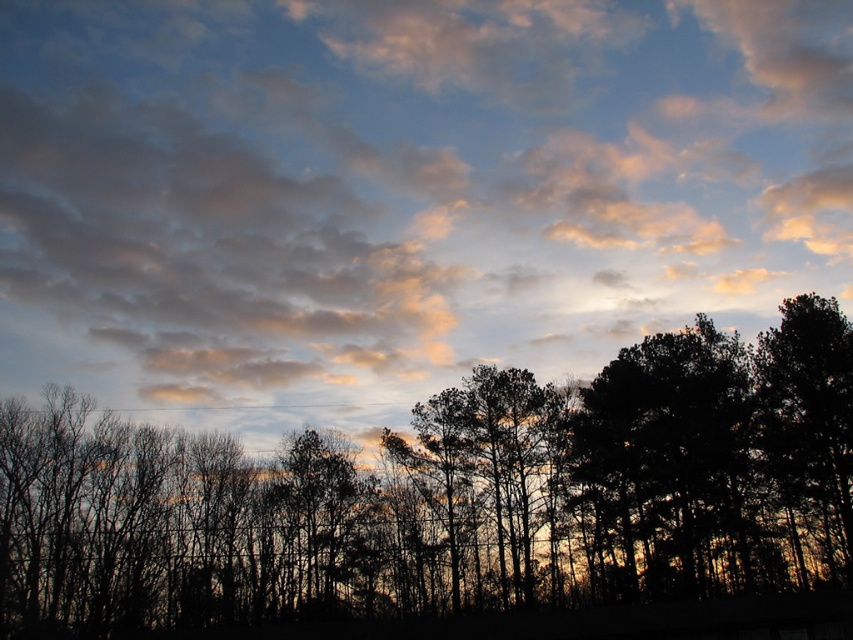
You are standing in the forest looking at the cloudy sky at upper center. If you want to take a photo of it with your camera, which is 1 meter tall, will you need to adjust your position to ensure the entire sky fits in the frame?

The cloudy sky at upper center is 60.82 meters away from the camera. Since the camera is only 1 meter tall, the distance is more than sufficient for the entire sky to fit in the frame without needing to adjust your position.

Consider the image. You are an artist trying to paint this sunset scene. You notice the silhouette trees at lower center and the dark green leafy tree at right. Which tree should you paint taller to accurately represent their sizes in the image?

The silhouette trees at lower center should be painted taller than the dark green leafy tree at right because the silhouette trees at lower center is much taller as dark green leafy tree at right.

You are standing in the forest looking at the sunset. There are two points in the scene labeled as point 1 and point 2. Point 1 is at coordinates (409, 538) and point 2 is at (773, 349). Which point is closer to you?

Point 1 is closer to you because it is closer to the viewer than point 2.